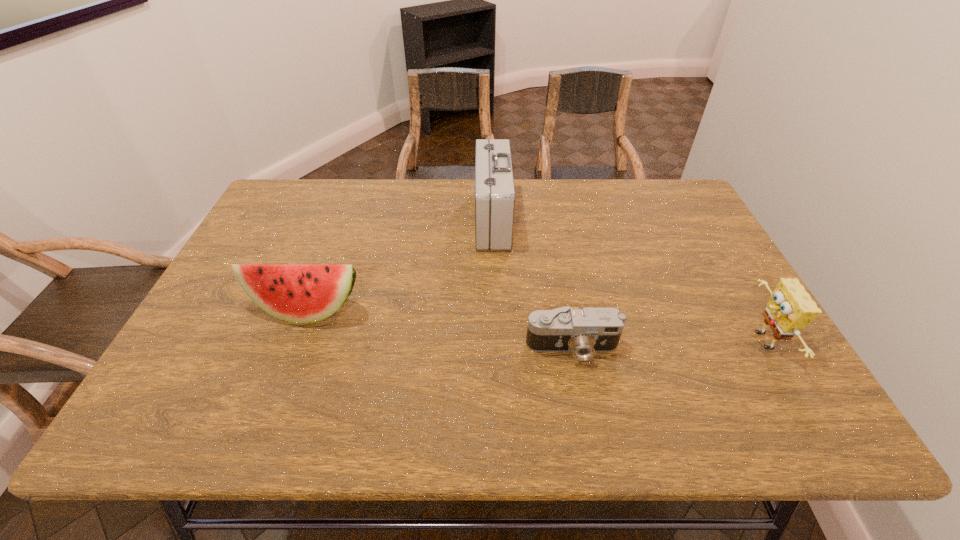
Identify which object is the second closest to the sponge. Please provide its 2D coordinates. Your answer should be formatted as a tuple, i.e. [(x, y)], where the tuple contains the x and y coordinates of a point satisfying the conditions above.

[(494, 184)]

You are a GUI agent. You are given a task and a screenshot of the screen. Output one action in this format:
    pyautogui.click(x=<x>, y=<y>)
    Task: Click on the free space in the image that satisfies the following two spatial constraints: 1. on the face of the sponge; 2. on the lens of the shortest object
    This screenshot has height=540, width=960.
    Given the screenshot: What is the action you would take?
    pyautogui.click(x=765, y=348)

The image size is (960, 540). Find the location of `free location that satisfies the following two spatial constraints: 1. on the front-facing side of the first-aid kit; 2. on the outer rind of the watermelon`. free location that satisfies the following two spatial constraints: 1. on the front-facing side of the first-aid kit; 2. on the outer rind of the watermelon is located at coordinates (495, 309).

Locate an element on the screen. vacant space that satisfies the following two spatial constraints: 1. on the face of the sponge; 2. on the lens of the shortest object is located at coordinates (765, 348).

Image resolution: width=960 pixels, height=540 pixels. I want to click on vacant area that satisfies the following two spatial constraints: 1. on the face of the sponge; 2. on the lens of the camera, so click(765, 348).